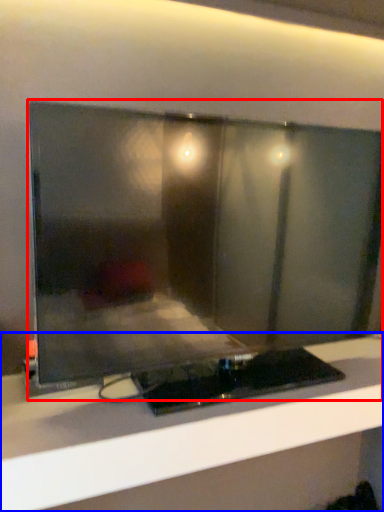
Question: Which object appears farthest to the camera in this image, computer monitor (highlighted by a red box) or furniture (highlighted by a blue box)?

Choices:
 (A) computer monitor
 (B) furniture

Answer: (B)